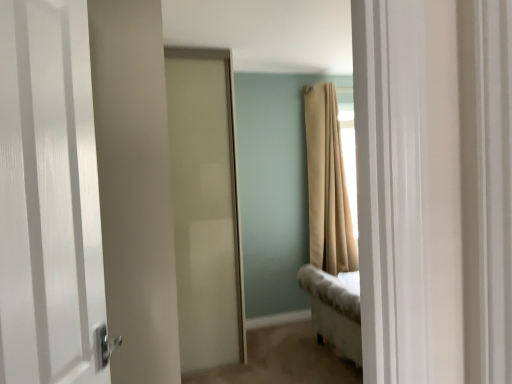
Question: Is beige fabric curtain at upper right taller than satin white door at center, placed as the 2th door when sorted from front to back?

Choices:
 (A) yes
 (B) no

Answer: (B)

Question: Is beige fabric curtain at upper right smaller than satin white door at center, placed as the 2th door when sorted from front to back?

Choices:
 (A) no
 (B) yes

Answer: (B)

Question: Does beige fabric curtain at upper right touch satin white door at center, the 1th door from the back?

Choices:
 (A) no
 (B) yes

Answer: (A)

Question: Could you tell me if beige fabric curtain at upper right is facing satin white door at center, the 1th door from the back?

Choices:
 (A) no
 (B) yes

Answer: (A)

Question: Is beige fabric curtain at upper right wider than satin white door at center, the 1th door from the back?

Choices:
 (A) no
 (B) yes

Answer: (A)

Question: Are beige fabric curtain at upper right and satin white door at center, placed as the 2th door when sorted from front to back, located far from each other?

Choices:
 (A) yes
 (B) no

Answer: (A)

Question: From the image's perspective, is satin white door at center, the 1th door from the back, on white glossy door at left, positioned as the first door in front-to-back order?

Choices:
 (A) no
 (B) yes

Answer: (A)

Question: Considering the relative sizes of satin white door at center, the 1th door from the back, and white glossy door at left, positioned as the first door in front-to-back order, in the image provided, is satin white door at center, the 1th door from the back, thinner than white glossy door at left, positioned as the first door in front-to-back order,?

Choices:
 (A) yes
 (B) no

Answer: (B)

Question: Is satin white door at center, the 1th door from the back, to the right of white glossy door at left, which is counted as the 2th door, starting from the back, from the viewer's perspective?

Choices:
 (A) yes
 (B) no

Answer: (A)

Question: Considering the relative positions of satin white door at center, the 1th door from the back, and white glossy door at left, which is counted as the 2th door, starting from the back, in the image provided, is satin white door at center, the 1th door from the back, to the left of white glossy door at left, which is counted as the 2th door, starting from the back, from the viewer's perspective?

Choices:
 (A) yes
 (B) no

Answer: (B)

Question: Is satin white door at center, placed as the 2th door when sorted from front to back, not near white glossy door at left, which is counted as the 2th door, starting from the back?

Choices:
 (A) yes
 (B) no

Answer: (A)

Question: Does satin white door at center, the 1th door from the back, have a greater height compared to white glossy door at left, positioned as the first door in front-to-back order?

Choices:
 (A) no
 (B) yes

Answer: (B)

Question: Considering the relative positions of white glossy door at left, positioned as the first door in front-to-back order, and beige fabric curtain at upper right in the image provided, is white glossy door at left, positioned as the first door in front-to-back order, to the left of beige fabric curtain at upper right from the viewer's perspective?

Choices:
 (A) no
 (B) yes

Answer: (B)